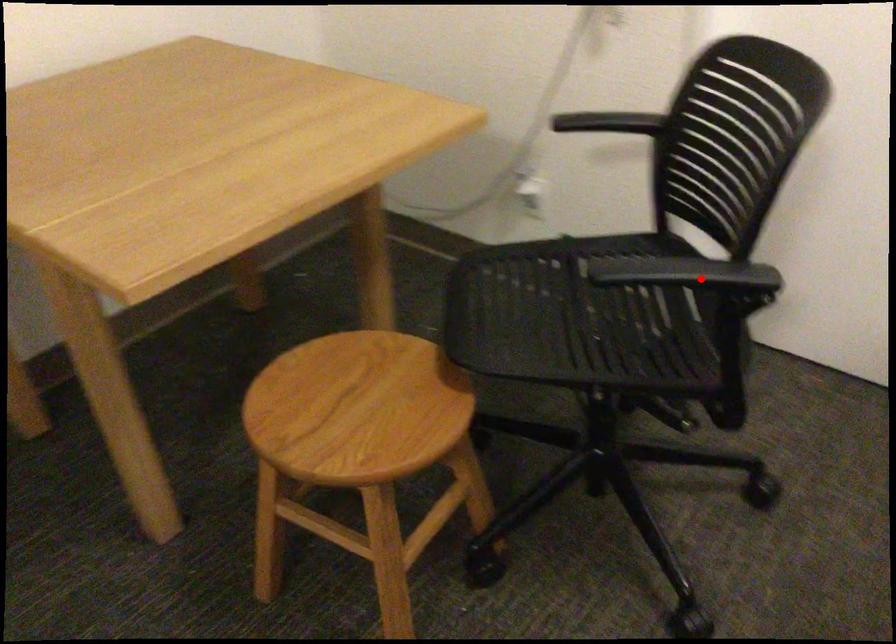
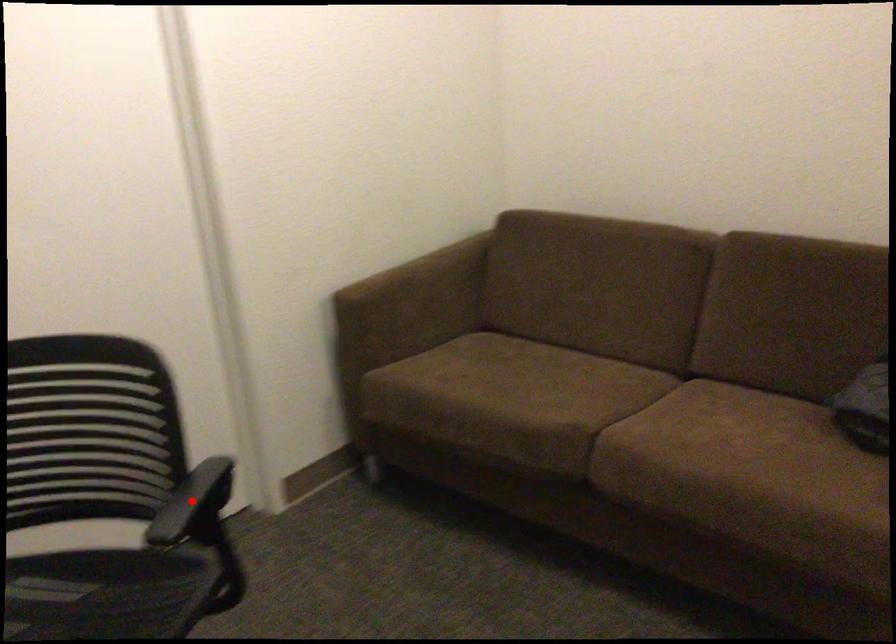
I am providing you with two images of the same scene from different viewpoints. A red point is marked on the first image and another point is marked on the second image. Does the point marked in image1 correspond to the same location as the one in image2?

Yes